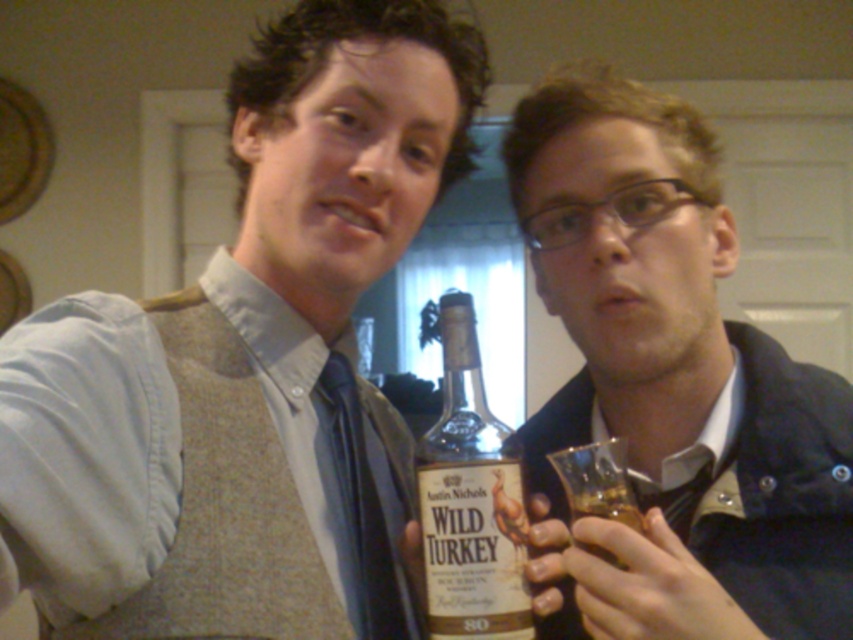
You are a bartender who needs to reach the translucent amber liquid at lower right to prepare a drink. There is a matte brown vest at center blocking your path. Can you move around the vest to access the liquid?

The matte brown vest at center is in front of the translucent amber liquid at lower right, so you can move around the vest to access the liquid as it is blocking the direct path but not necessarily the entire area.

You are standing in the room shown in the image and want to reach the point at coordinates point (x=108, y=480). If your arm is 20 inches long, can you reach that point without moving your feet?

The point (x=108, y=480) is 21.32 inches away from the viewer. Since your arm is only 20 inches long, you cannot reach the point (x=108, y=480) without moving your feet.